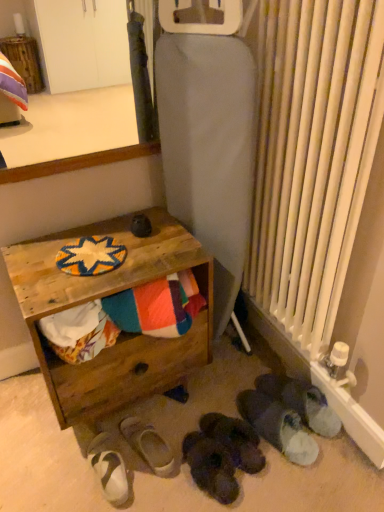
Where is `free area in between black suede slippers at lower center, acting as the 4th footwear starting from the left, and white fuzzy slippers at lower right, placed as the 5th footwear when sorted from left to right`? The width and height of the screenshot is (384, 512). free area in between black suede slippers at lower center, acting as the 4th footwear starting from the left, and white fuzzy slippers at lower right, placed as the 5th footwear when sorted from left to right is located at coordinates (262, 465).